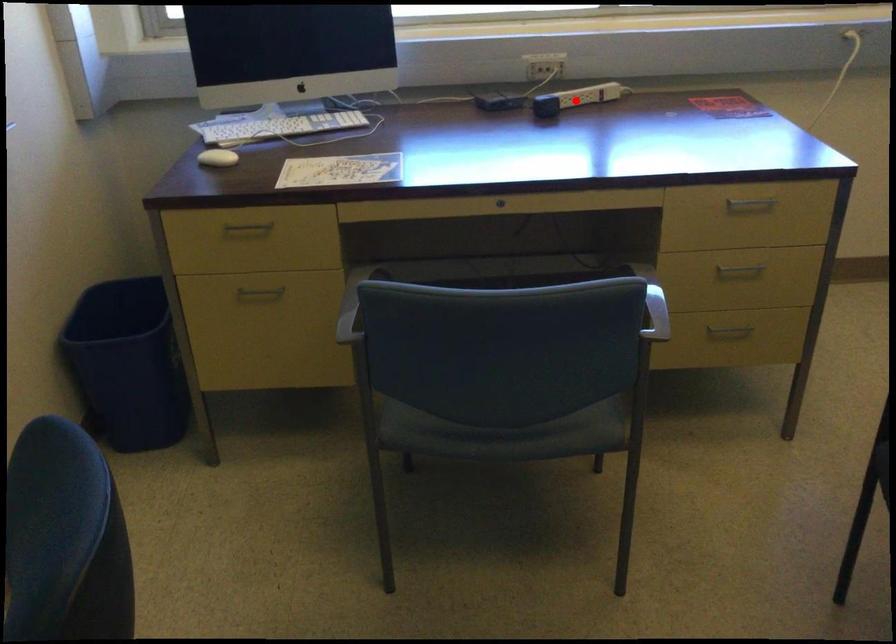
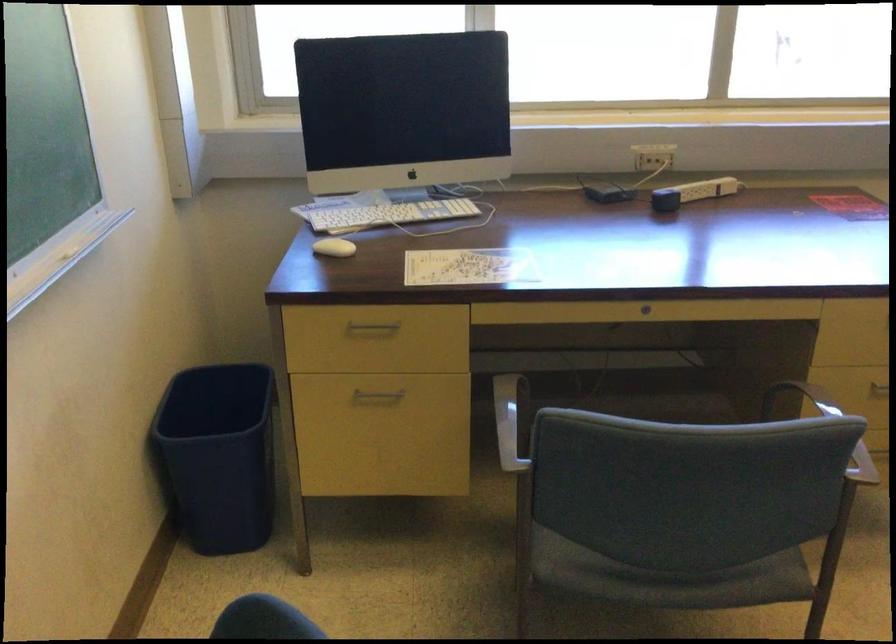
Find the pixel in the second image that matches the highlighted location in the first image.

(692, 193)